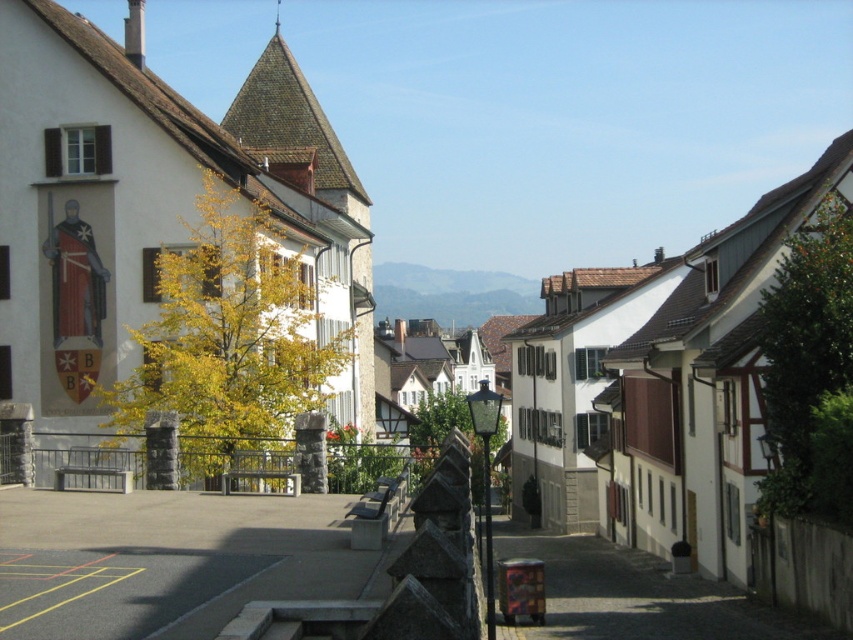
You are standing on the street and want to walk towards both the yellow leafy tree at left and the green leafy tree at right. Which tree will you reach first?

The yellow leafy tree at left will be reached first because it is closer to the viewer compared to the green leafy tree at right.

You are a delivery drone that needs to fly between the yellow leafy tree at left and the green leafy tree at right. The drone has a wingspan of 1.2 meters. Can the drone safely pass through the gap between them?

The distance between the yellow leafy tree at left and the green leafy tree at right is 11.61 meters, which is much wider than the drone wingspan of 1.2 meters. The drone can safely pass through the gap between them.